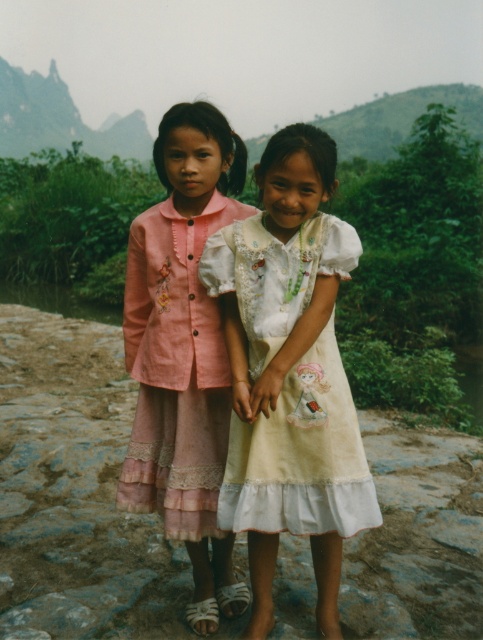
Question: Among these points, which one is nearest to the camera?

Choices:
 (A) (274, 438)
 (B) (174, 317)

Answer: (A)

Question: Can you confirm if white cotton dress at center is positioned to the left of pink lace dress at center?

Choices:
 (A) no
 (B) yes

Answer: (A)

Question: Which object appears farthest from the camera in this image?

Choices:
 (A) white cotton dress at center
 (B) pink lace dress at center

Answer: (B)

Question: Can you confirm if white cotton dress at center is positioned to the right of pink lace dress at center?

Choices:
 (A) yes
 (B) no

Answer: (A)

Question: Is white cotton dress at center bigger than pink lace dress at center?

Choices:
 (A) no
 (B) yes

Answer: (A)